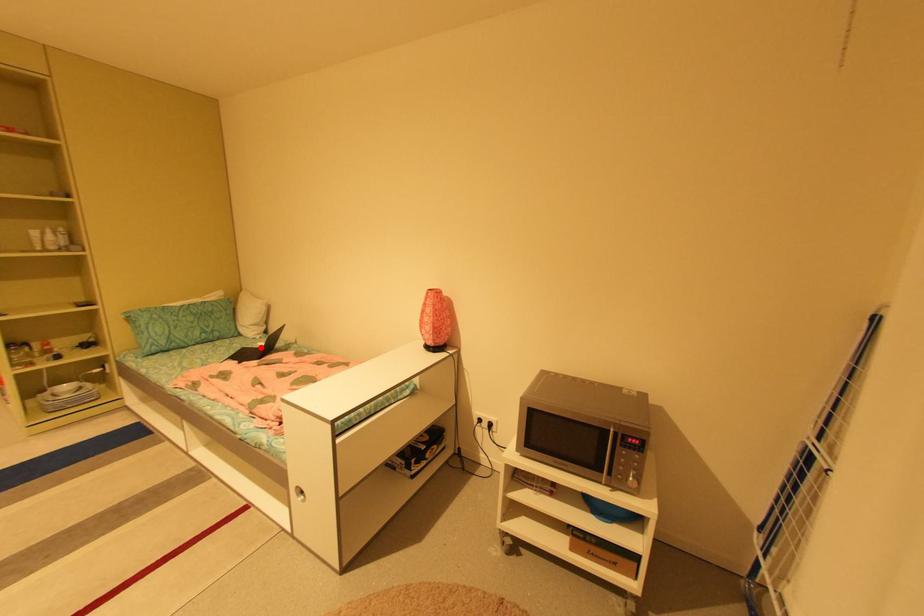
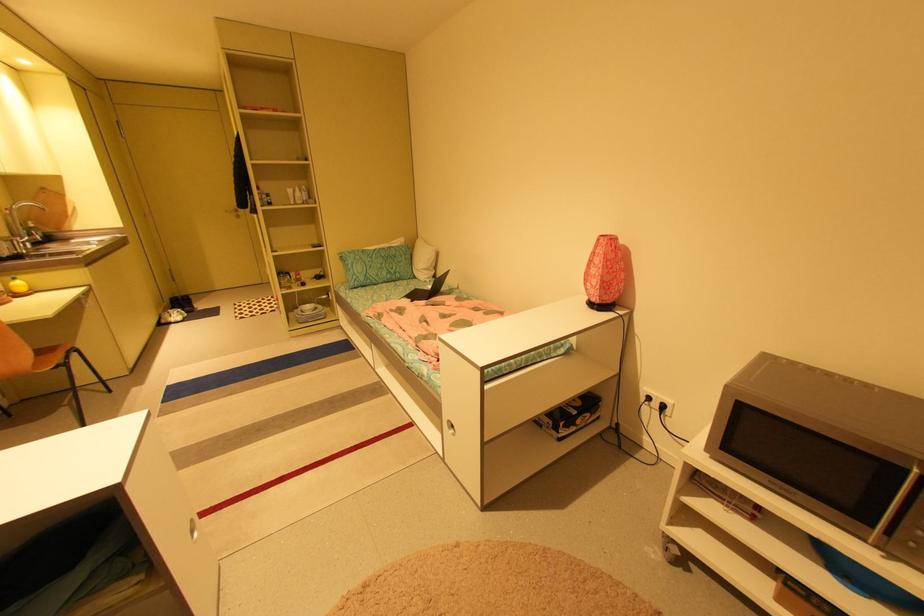
Question: A red point is marked in image1. In image2, is the corresponding 3D point closer to the camera or farther? Reply with the corresponding letter.

Choices:
 (A) The corresponding 3D point is closer.
 (B) The corresponding 3D point is farther.

Answer: (B)